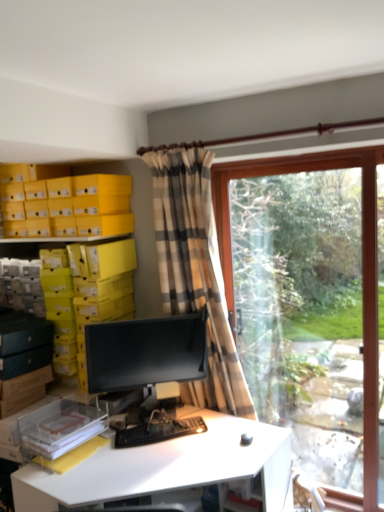
The image size is (384, 512). Describe the element at coordinates (158, 432) in the screenshot. I see `black matte keyboard at center` at that location.

This screenshot has width=384, height=512. What do you see at coordinates (67, 205) in the screenshot?
I see `yellow cardboard boxes at upper left` at bounding box center [67, 205].

Where is `white glossy desk at center`? The width and height of the screenshot is (384, 512). white glossy desk at center is located at coordinates (167, 467).

Can you tell me how much clear glass window at right and black matte keyboard at center differ in facing direction?

The angular difference between clear glass window at right and black matte keyboard at center is 43.5 degrees.

Who is taller, clear glass window at right or black matte keyboard at center?

With more height is clear glass window at right.

Where is `computer keyboard on the left of clear glass window at right`? The height and width of the screenshot is (512, 384). computer keyboard on the left of clear glass window at right is located at coordinates (158, 432).

Between clear glass window at right and matte black monitor at center, which one has larger size?

Bigger between the two is clear glass window at right.

Locate an element on the screen. This screenshot has width=384, height=512. window above the matte black monitor at center (from the image's perspective) is located at coordinates (308, 304).

Which of these two, clear glass window at right or matte black monitor at center, is thinner?

Thinner between the two is matte black monitor at center.

Which object is closer to the camera, clear glass window at right or matte black monitor at center?

clear glass window at right.

What's the angular difference between plaid fabric curtain at center and white glossy desk at center's facing directions?

The angular difference between plaid fabric curtain at center and white glossy desk at center is 6.25 degrees.

Is point (212, 298) positioned in front of point (246, 426)?

No, (212, 298) is behind (246, 426).

Which object is thinner, plaid fabric curtain at center or white glossy desk at center?

plaid fabric curtain at center.

Which is more to the right, yellow cardboard boxes at upper left or matte black monitor at center?

From the viewer's perspective, matte black monitor at center appears more on the right side.

Where is `shelf behind the matte black monitor at center`? The image size is (384, 512). shelf behind the matte black monitor at center is located at coordinates (67, 205).

From a real-world perspective, is yellow cardboard boxes at upper left located beneath matte black monitor at center?

Actually, yellow cardboard boxes at upper left is physically above matte black monitor at center in the real world.

Can you confirm if yellow cardboard boxes at upper left is smaller than matte black monitor at center?

Actually, yellow cardboard boxes at upper left might be larger than matte black monitor at center.

Between black matte keyboard at center and white glossy desk at center, which one has smaller size?

black matte keyboard at center.

Considering the sizes of objects black matte keyboard at center and white glossy desk at center in the image provided, who is wider, black matte keyboard at center or white glossy desk at center?

white glossy desk at center.

Is plaid fabric curtain at center aimed at clear glass window at right?

No, plaid fabric curtain at center is not oriented towards clear glass window at right.

In terms of width, does plaid fabric curtain at center look wider or thinner when compared to clear glass window at right?

In the image, plaid fabric curtain at center appears to be wider than clear glass window at right.

Is plaid fabric curtain at center bigger than clear glass window at right?

No, plaid fabric curtain at center is not bigger than clear glass window at right.

This screenshot has height=512, width=384. In order to click on curtain located behind the white glossy desk at center in this screenshot , I will do `click(195, 270)`.

Between white glossy desk at center and plaid fabric curtain at center, which one is positioned in front?

Positioned in front is white glossy desk at center.

From the picture: Does white glossy desk at center have a smaller size compared to plaid fabric curtain at center?

No.

Where is `window behind the black matte keyboard at center`? This screenshot has width=384, height=512. window behind the black matte keyboard at center is located at coordinates (308, 304).

Locate an element on the screen. computer monitor below the clear glass window at right (from a real-world perspective) is located at coordinates (146, 352).

From the image, which object appears to be farther from clear glass window at right, yellow cardboard boxes at upper left or plaid fabric curtain at center?

yellow cardboard boxes at upper left is further to clear glass window at right.

Considering their positions, is matte black monitor at center positioned further to clear glass window at right than yellow cardboard boxes at upper left?

yellow cardboard boxes at upper left.

Estimate the real-world distances between objects in this image. Which object is further from white glossy desk at center, matte black monitor at center or black matte keyboard at center?

The object further to white glossy desk at center is matte black monitor at center.

Estimate the real-world distances between objects in this image. Which object is further from clear glass window at right, plaid fabric curtain at center or white glossy desk at center?

white glossy desk at center.

Based on their spatial positions, is yellow cardboard boxes at upper left or black matte keyboard at center closer to white glossy desk at center?

black matte keyboard at center lies closer to white glossy desk at center than the other object.

Estimate the real-world distances between objects in this image. Which object is further from plaid fabric curtain at center, matte black monitor at center or clear glass window at right?

clear glass window at right is further to plaid fabric curtain at center.

Considering their positions, is clear glass window at right positioned further to white glossy desk at center than black matte keyboard at center?

clear glass window at right is positioned further to the anchor white glossy desk at center.

Considering their positions, is matte black monitor at center positioned closer to clear glass window at right than plaid fabric curtain at center?

The object closer to clear glass window at right is plaid fabric curtain at center.

Image resolution: width=384 pixels, height=512 pixels. Identify the location of curtain that lies between yellow cardboard boxes at upper left and black matte keyboard at center from top to bottom. (195, 270).

Identify the location of window between yellow cardboard boxes at upper left and white glossy desk at center from top to bottom. Image resolution: width=384 pixels, height=512 pixels. (308, 304).

Image resolution: width=384 pixels, height=512 pixels. Find the location of `curtain between yellow cardboard boxes at upper left and clear glass window at right in the horizontal direction`. curtain between yellow cardboard boxes at upper left and clear glass window at right in the horizontal direction is located at coordinates [195, 270].

This screenshot has width=384, height=512. In order to click on computer keyboard between plaid fabric curtain at center and white glossy desk at center from top to bottom in this screenshot , I will do `click(158, 432)`.